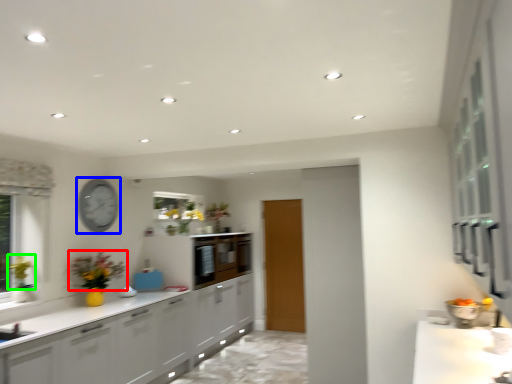
Question: Considering the real-world distances, which object is closest to flower (highlighted by a red box)? clock (highlighted by a blue box) or floral arrangement (highlighted by a green box).

Choices:
 (A) clock
 (B) floral arrangement

Answer: (A)